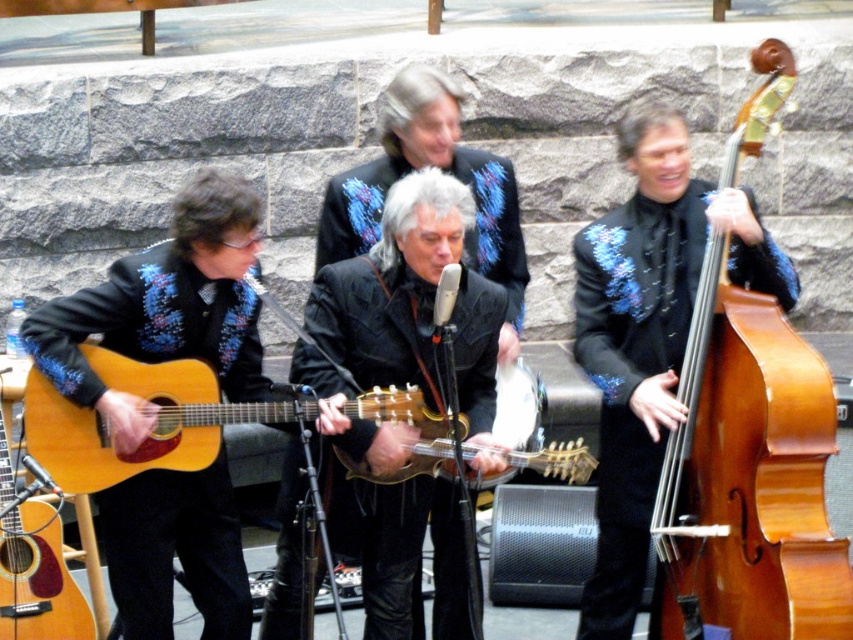
Identify the location of shiny black guitar at center. This screenshot has width=853, height=640. (440, 168).

Which of these two, shiny black guitar at center or shiny gold guitar at center, stands taller?

shiny black guitar at center

Is point (457, 122) positioned in front of point (577, 445)?

No, (457, 122) is behind (577, 445).

Image resolution: width=853 pixels, height=640 pixels. In order to click on shiny black guitar at center in this screenshot , I will do `click(440, 168)`.

Can you confirm if shiny black guitar at center is thinner than matte wood guitar at left?

In fact, shiny black guitar at center might be wider than matte wood guitar at left.

How far apart are shiny black guitar at center and matte wood guitar at left?

shiny black guitar at center is 5.79 feet from matte wood guitar at left.

Does point (515, 310) come farther from viewer compared to point (45, 566)?

Yes, it is.

Find the location of a particular element. This screenshot has width=853, height=640. shiny black guitar at center is located at coordinates coord(440,168).

Can you confirm if brown wooden cello at right is thinner than light brown wood guitar at center?

Yes, brown wooden cello at right is thinner than light brown wood guitar at center.

Who is positioned more to the left, brown wooden cello at right or light brown wood guitar at center?

light brown wood guitar at center

Measure the distance between point (x=717, y=336) and camera.

The distance of point (x=717, y=336) from camera is 12.73 feet.

Locate an element on the screen. The width and height of the screenshot is (853, 640). brown wooden cello at right is located at coordinates (749, 476).